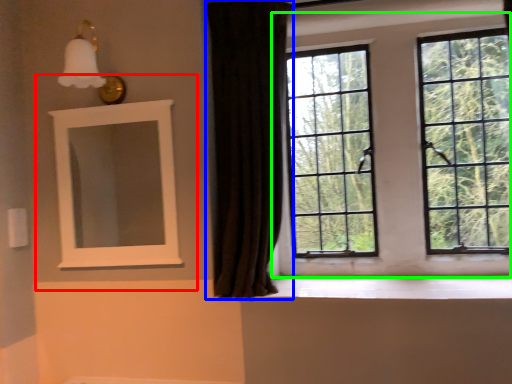
Question: Which is nearer to the medicine cabinet (highlighted by a red box)? curtain (highlighted by a blue box) or window (highlighted by a green box).

Choices:
 (A) curtain
 (B) window

Answer: (A)